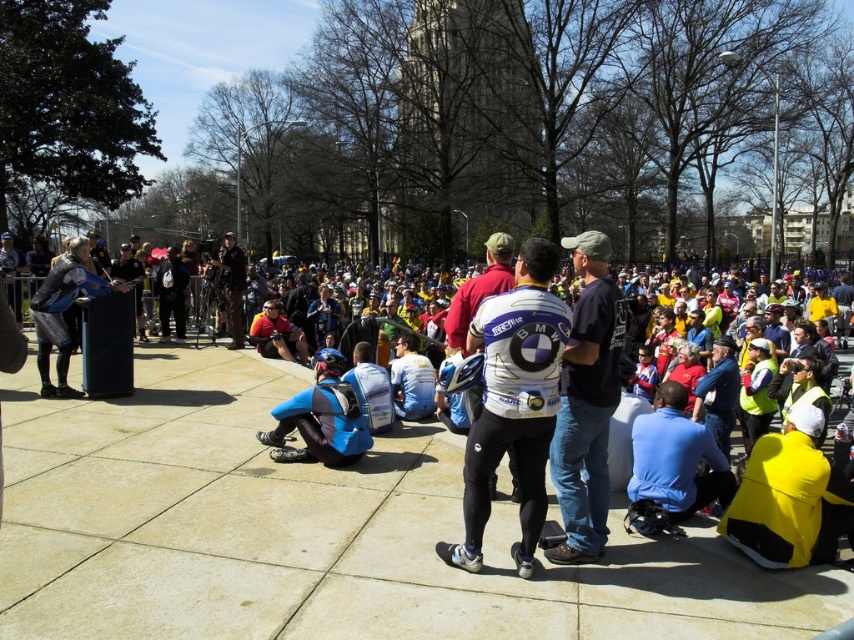
Can you confirm if yellow matte jacket at lower right is smaller than blue fabric jacket at lower right?

No.

Can you confirm if yellow matte jacket at lower right is positioned below blue fabric jacket at lower right?

Incorrect, yellow matte jacket at lower right is not positioned below blue fabric jacket at lower right.

Describe the element at coordinates (790, 497) in the screenshot. This screenshot has height=640, width=854. I see `yellow matte jacket at lower right` at that location.

You are a GUI agent. You are given a task and a screenshot of the screen. Output one action in this format:
    pyautogui.click(x=<x>, y=<y>)
    Task: Click on the yellow matte jacket at lower right
    Image resolution: width=854 pixels, height=640 pixels.
    Given the screenshot: What is the action you would take?
    click(x=790, y=497)

Is dark blue uniform at center positioned behind matte blue cycling jersey at center?

Yes.

Which of these two, dark blue uniform at center or matte blue cycling jersey at center, stands shorter?

matte blue cycling jersey at center is shorter.

The width and height of the screenshot is (854, 640). In order to click on dark blue uniform at center in this screenshot , I will do `click(231, 285)`.

Is blue fabric jacket at lower right positioned in front of blue synthetic suit at center?

Yes, blue fabric jacket at lower right is in front of blue synthetic suit at center.

Is blue fabric jacket at lower right thinner than blue synthetic suit at center?

Yes.

Is point (679, 472) positioned behind point (311, 432)?

No.

Locate an element on the screen. The image size is (854, 640). blue fabric jacket at lower right is located at coordinates (676, 458).